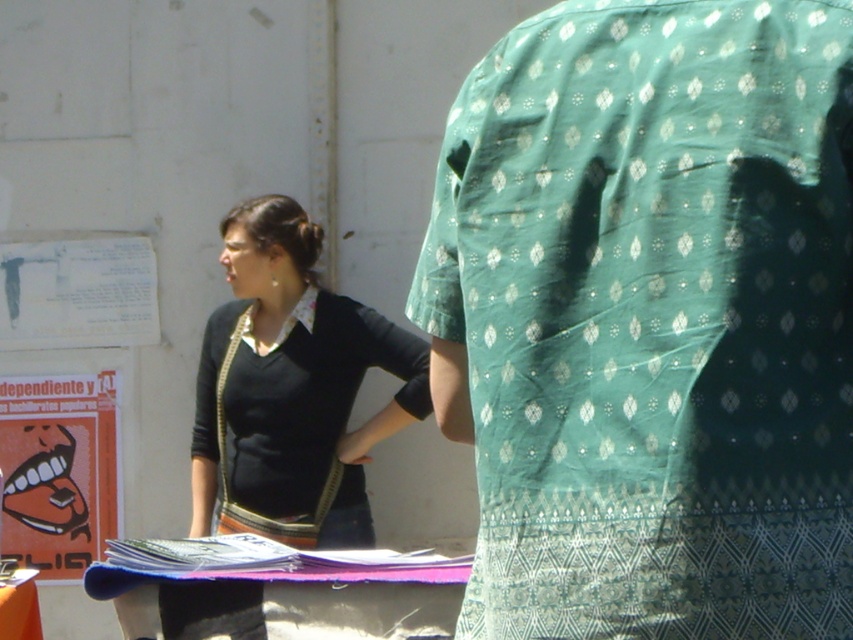
You are standing in front of a table with items on it. You see a green printed fabric at center and a black jersey at center. Which object is positioned to the right side of the other?

The green printed fabric at center is to the right of the black jersey at center.

You are organizing a craft fair and need to display two items on a table. You have a green printed fabric at center and a black jersey at center. Which item should you choose if you want to place a small decorative item on top of it without covering the entire surface?

The green printed fabric at center has a smaller size compared to the black jersey at center, so placing a small decorative item on the green printed fabric at center would leave more of the table visible while still providing a base for the item.

What is the location of the green printed fabric at center in the image?

The green printed fabric at center is located at point [651,320].